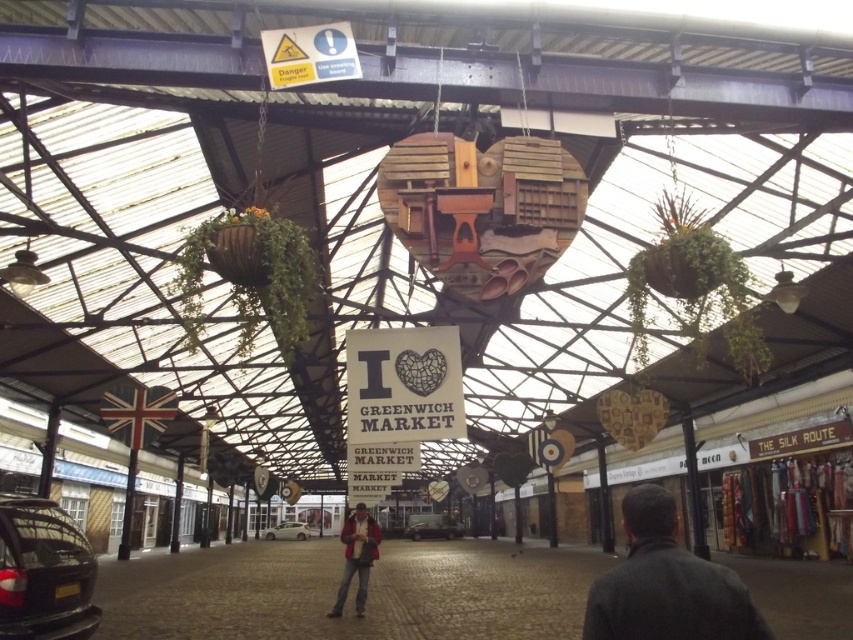
You are standing in Greenwich Market and see the dark gray coat at lower right and the shiny black car at lower left. Which object is positioned lower in the scene?

The dark gray coat at lower right is located below the shiny black car at lower left, so it is positioned lower in the scene.

You are a delivery person who needs to place a package on the metallic silver car at center. However, there is a dark gray coat at lower right in the way. Based on the scene, can you move the coat to access the car?

The dark gray coat at lower right is positioned over the metallic silver car at center, so you need to move the dark gray coat at lower right to access the car.

Consider the image. You are a store manager at Greenwich Market and need to place a mannequin between the dark gray coat at lower right and the red jacket at center. The mannequin requires 1 meter of space. Can you fit it there?

The dark gray coat at lower right is wider than the red jacket at center. However, the question is about the space between them, not their widths. Since the objects description only provides information about their widths, not the distance between them, we cannot determine if the mannequin will fit based on the given information.